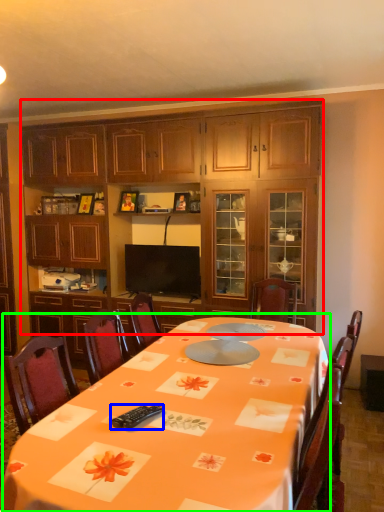
Question: Which is farther away from cabinetry (highlighted by a red box)? remote control (highlighted by a blue box) or round table (highlighted by a green box)?

Choices:
 (A) remote control
 (B) round table

Answer: (A)